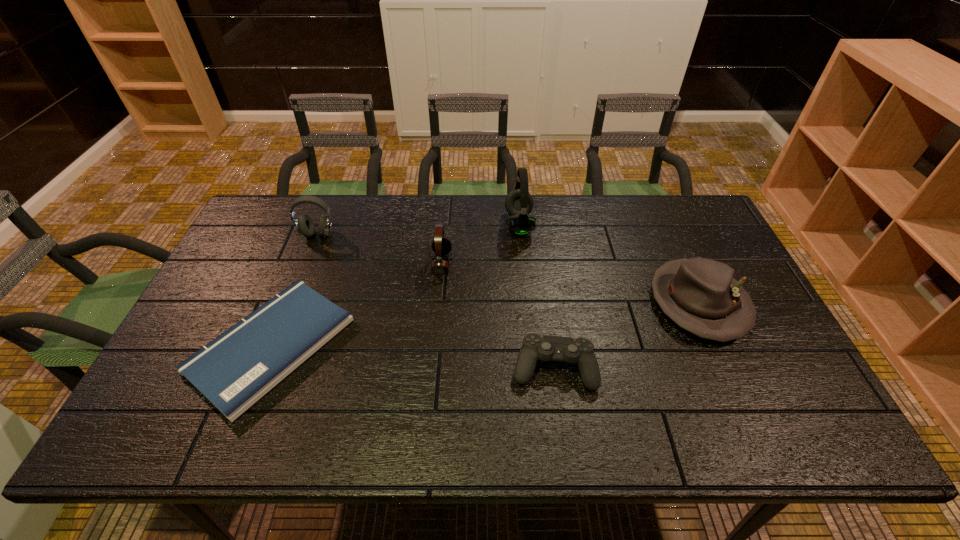
You are a GUI agent. You are given a task and a screenshot of the screen. Output one action in this format:
    pyautogui.click(x=<x>, y=<y>)
    Task: Click on the free area in between the rightmost object and the second shortest object
    This screenshot has height=540, width=960.
    Given the screenshot: What is the action you would take?
    pyautogui.click(x=626, y=335)

Where is `vacant space that's between the rightmost object and the leftmost headset`? The image size is (960, 540). vacant space that's between the rightmost object and the leftmost headset is located at coordinates pos(508,269).

I want to click on free point between the second shortest object and the rightmost object, so click(626, 335).

You are a GUI agent. You are given a task and a screenshot of the screen. Output one action in this format:
    pyautogui.click(x=<x>, y=<y>)
    Task: Click on the free space between the leftmost headset and the rightmost object
    The height and width of the screenshot is (540, 960).
    Given the screenshot: What is the action you would take?
    pyautogui.click(x=508, y=269)

The height and width of the screenshot is (540, 960). What are the coordinates of `free space between the control and the shortest object` in the screenshot? It's located at (413, 356).

I want to click on object that is the second closest to the leftmost headset, so click(x=441, y=245).

Select which object appears as the fifth closest to the hat. Please provide its 2D coordinates. Your answer should be formatted as a tuple, i.e. [(x, y)], where the tuple contains the x and y coordinates of a point satisfying the conditions above.

[(304, 225)]

You are a GUI agent. You are given a task and a screenshot of the screen. Output one action in this format:
    pyautogui.click(x=<x>, y=<y>)
    Task: Click on the headset that stands as the third closest to the fifth tallest object
    
    Given the screenshot: What is the action you would take?
    pyautogui.click(x=304, y=225)

You are a GUI agent. You are given a task and a screenshot of the screen. Output one action in this format:
    pyautogui.click(x=<x>, y=<y>)
    Task: Click on the third closest headset to the hat
    The image size is (960, 540).
    Given the screenshot: What is the action you would take?
    tap(304, 225)

Identify the location of free location that satisfies the following two spatial constraints: 1. on the ear cups of the second shortest object; 2. on the right side of the leftmost headset. (266, 368).